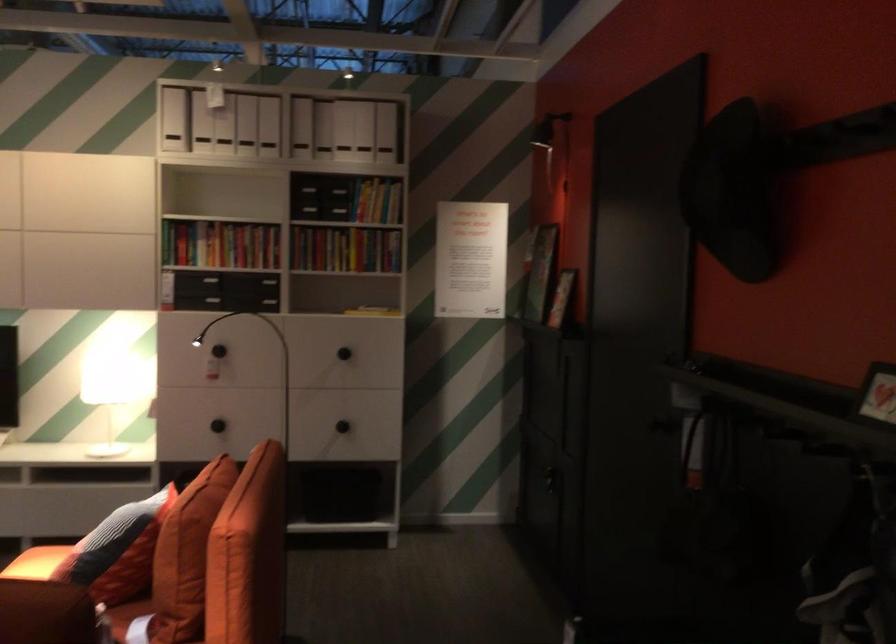
The image size is (896, 644). What are the coordinates of `white table lamp` in the screenshot? It's located at (108, 391).